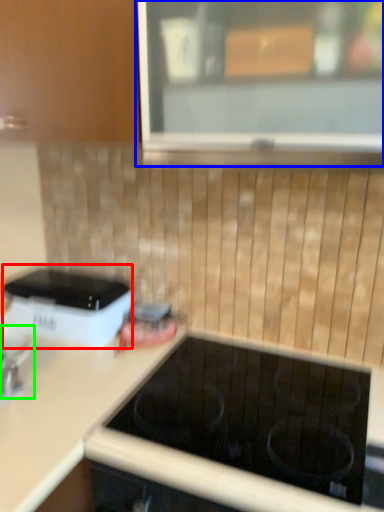
Question: Which is nearer to the home appliance (highlighted by a red box)? window (highlighted by a blue box) or appliance (highlighted by a green box).

Choices:
 (A) window
 (B) appliance

Answer: (B)